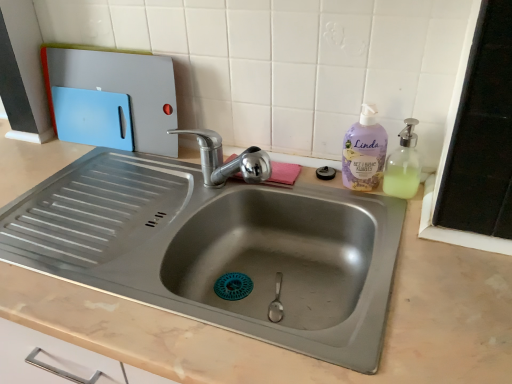
Image resolution: width=512 pixels, height=384 pixels. What do you see at coordinates (124, 88) in the screenshot? I see `blue plastic cutting board at upper left` at bounding box center [124, 88].

The width and height of the screenshot is (512, 384). What do you see at coordinates (364, 151) in the screenshot?
I see `lavender plastic bottle at right` at bounding box center [364, 151].

Identify the location of blue plastic cutting board at upper left. The image size is (512, 384). (124, 88).

Based on the photo, is lavender plastic bottle at right spatially inside translucent plastic soap dispenser at right, or outside of it?

lavender plastic bottle at right exists outside the volume of translucent plastic soap dispenser at right.

From a real-world perspective, does lavender plastic bottle at right sit lower than translucent plastic soap dispenser at right?

Incorrect, from a real-world perspective, lavender plastic bottle at right is higher than translucent plastic soap dispenser at right.

Is translucent plastic soap dispenser at right at the back of lavender plastic bottle at right?

lavender plastic bottle at right is not turned away from translucent plastic soap dispenser at right.

Is translucent plastic soap dispenser at right completely or partially inside blue plastic cutting board at upper left?

No, blue plastic cutting board at upper left does not contain translucent plastic soap dispenser at right.

In order to click on appliance positioned vertically above the translucent plastic soap dispenser at right (from a real-world perspective) in this screenshot , I will do `click(124, 88)`.

From a real-world perspective, is blue plastic cutting board at upper left above or below translucent plastic soap dispenser at right?

In terms of real-world spatial position, blue plastic cutting board at upper left is above translucent plastic soap dispenser at right.

Does translucent plastic soap dispenser at right have a greater width compared to blue plastic cutting board at upper left?

Correct, the width of translucent plastic soap dispenser at right exceeds that of blue plastic cutting board at upper left.

Consider the image. Is translucent plastic soap dispenser at right with blue plastic cutting board at upper left?

translucent plastic soap dispenser at right is not next to blue plastic cutting board at upper left, and they're not touching.

Considering the sizes of translucent plastic soap dispenser at right and blue plastic cutting board at upper left in the image, is translucent plastic soap dispenser at right bigger or smaller than blue plastic cutting board at upper left?

Clearly, translucent plastic soap dispenser at right is smaller in size than blue plastic cutting board at upper left.

Is point (420, 165) more distant than point (125, 56)?

That is False.

Is blue plastic cutting board at upper left taller or shorter than lavender plastic bottle at right?

Considering their sizes, blue plastic cutting board at upper left has more height than lavender plastic bottle at right.

Between blue plastic cutting board at upper left and lavender plastic bottle at right, which one has larger width?

Wider between the two is lavender plastic bottle at right.

Is blue plastic cutting board at upper left turned away from lavender plastic bottle at right?

No, blue plastic cutting board at upper left is not facing away from lavender plastic bottle at right.

Looking at this image, is blue plastic cutting board at upper left at the right side of lavender plastic bottle at right?

Incorrect, blue plastic cutting board at upper left is not on the right side of lavender plastic bottle at right.

Considering the positions of objects lavender plastic bottle at right and blue plastic cutting board at upper left in the image provided, who is more to the left, lavender plastic bottle at right or blue plastic cutting board at upper left?

blue plastic cutting board at upper left is more to the left.

Considering the sizes of objects lavender plastic bottle at right and blue plastic cutting board at upper left in the image provided, who is shorter, lavender plastic bottle at right or blue plastic cutting board at upper left?

lavender plastic bottle at right.

Could you tell me if lavender plastic bottle at right is facing blue plastic cutting board at upper left?

No, lavender plastic bottle at right is not aimed at blue plastic cutting board at upper left.

What are the coordinates of `appliance located above the lavender plastic bottle at right (from the image's perspective)` in the screenshot? It's located at (124, 88).

Considering the positions of objects translucent plastic soap dispenser at right and lavender plastic bottle at right in the image provided, who is in front, translucent plastic soap dispenser at right or lavender plastic bottle at right?

Positioned in front is translucent plastic soap dispenser at right.

Is translucent plastic soap dispenser at right oriented towards lavender plastic bottle at right?

No, translucent plastic soap dispenser at right does not turn towards lavender plastic bottle at right.

What are the coordinates of `cleaning product that is on the left side of translucent plastic soap dispenser at right` in the screenshot? It's located at (364, 151).

Between translucent plastic soap dispenser at right and lavender plastic bottle at right, which one has smaller width?

lavender plastic bottle at right.

In the image, there is a lavender plastic bottle at right. At what (x,y) coordinates should I click in order to perform the action: click on soap dispenser below it (from the image's perspective). Please return your answer as a coordinate pair (x, y). The width and height of the screenshot is (512, 384). Looking at the image, I should click on click(403, 165).

Where is `soap dispenser directly beneath the blue plastic cutting board at upper left (from a real-world perspective)`? soap dispenser directly beneath the blue plastic cutting board at upper left (from a real-world perspective) is located at coordinates (403, 165).

Based on the photo, from the image, which object appears to be nearer to lavender plastic bottle at right, blue plastic cutting board at upper left or translucent plastic soap dispenser at right?

translucent plastic soap dispenser at right lies closer to lavender plastic bottle at right than the other object.

Looking at the image, which one is located closer to blue plastic cutting board at upper left, translucent plastic soap dispenser at right or lavender plastic bottle at right?

Among the two, lavender plastic bottle at right is located nearer to blue plastic cutting board at upper left.

Estimate the real-world distances between objects in this image. Which object is further from translucent plastic soap dispenser at right, lavender plastic bottle at right or blue plastic cutting board at upper left?

blue plastic cutting board at upper left lies further to translucent plastic soap dispenser at right than the other object.

When comparing their distances from translucent plastic soap dispenser at right, does blue plastic cutting board at upper left or lavender plastic bottle at right seem closer?

lavender plastic bottle at right is positioned closer to the anchor translucent plastic soap dispenser at right.

When comparing their distances from lavender plastic bottle at right, does translucent plastic soap dispenser at right or blue plastic cutting board at upper left seem closer?

translucent plastic soap dispenser at right is closer to lavender plastic bottle at right.

Which object lies nearer to the anchor point blue plastic cutting board at upper left, lavender plastic bottle at right or translucent plastic soap dispenser at right?

Among the two, lavender plastic bottle at right is located nearer to blue plastic cutting board at upper left.

You are a GUI agent. You are given a task and a screenshot of the screen. Output one action in this format:
    pyautogui.click(x=<x>, y=<y>)
    Task: Click on the cleaning product between blue plastic cutting board at upper left and translucent plastic soap dispenser at right from left to right
    This screenshot has height=384, width=512.
    Given the screenshot: What is the action you would take?
    pyautogui.click(x=364, y=151)